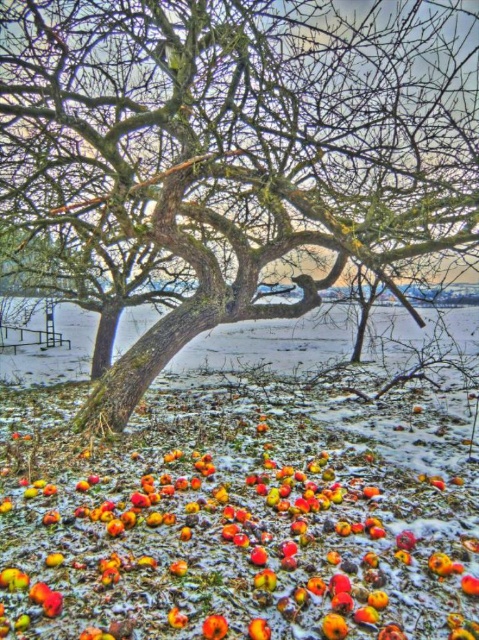
Can you confirm if rough bark tree at center is positioned to the right of shiny red apple at center?

In fact, rough bark tree at center is to the left of shiny red apple at center.

Who is more distant from viewer, (296, 168) or (205, 621)?

The point (296, 168) is more distant.

Is point (251, 317) in front of point (215, 616)?

No.

Find the location of `rough bark tree at center`. rough bark tree at center is located at coordinates (242, 141).